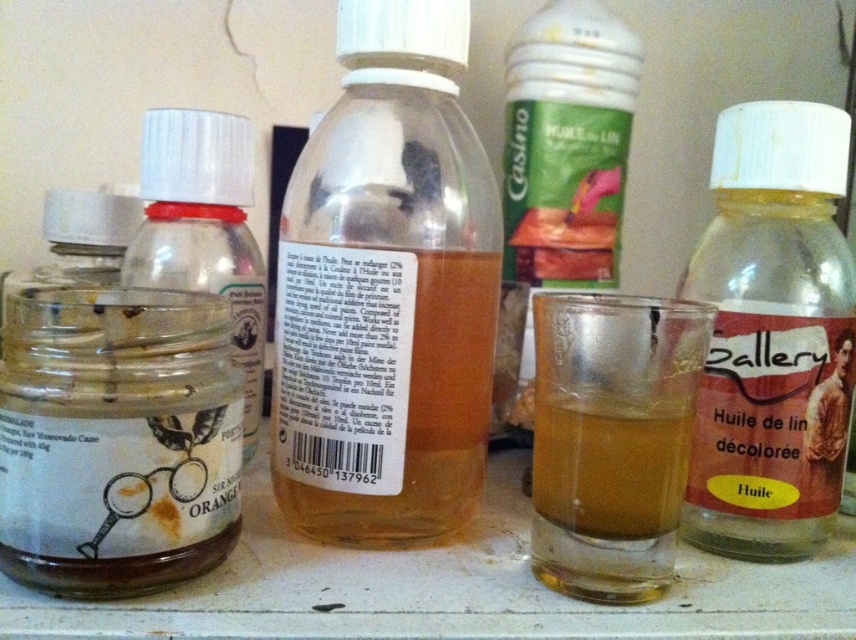
Question: Does transparent glass jar at center-left come in front of translucent amber liquid at center?

Choices:
 (A) no
 (B) yes

Answer: (B)

Question: Considering the real-world distances, which object is closest to the translucent plastic bottle at center?

Choices:
 (A) translucent amber liquid at center
 (B) transparent glass jar at center-left
 (C) translucent glass bottle at left
 (D) translucent glass cup at center

Answer: (D)

Question: Is transparent glass jar at center-left smaller than translucent amber liquid at center?

Choices:
 (A) no
 (B) yes

Answer: (A)

Question: Which point appears closest to the camera in this image?

Choices:
 (A) (777, 253)
 (B) (538, 433)
 (C) (388, 182)

Answer: (B)

Question: Among these points, which one is nearest to the camera?

Choices:
 (A) (633, 426)
 (B) (88, 509)
 (C) (331, 524)
 (D) (589, 436)

Answer: (B)

Question: Can you confirm if translucent glass bottle at left is wider than translucent amber liquid at center?

Choices:
 (A) no
 (B) yes

Answer: (B)